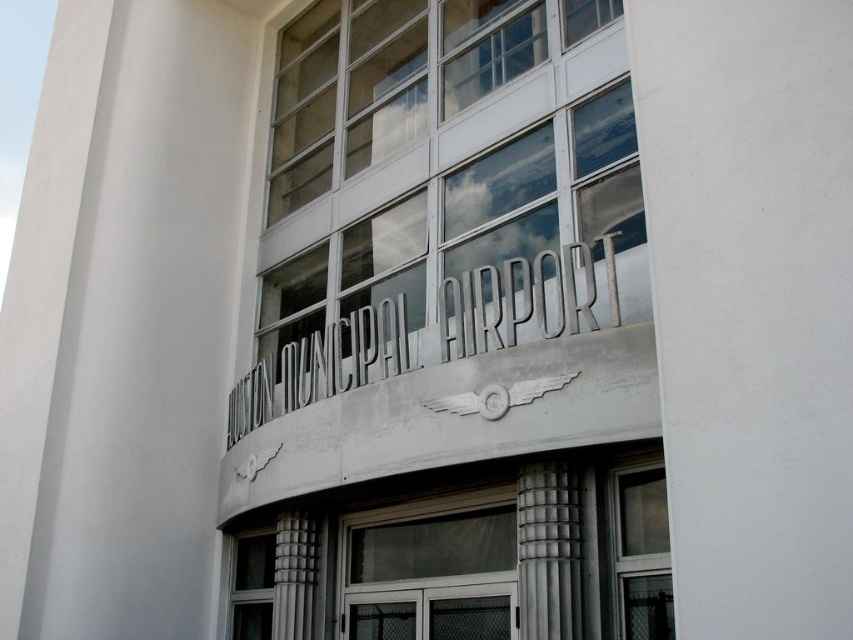
You are a maintenance worker inspecting the Houston Municipal Airport terminal. You need to access the clear glass windows at center and the gray concrete column at right for inspection. Based on their positions, which object is located to the left of the other?

The clear glass windows at center is positioned on the left side of gray concrete column at right, so the clear glass windows at center is to the left of the gray concrete column at right.

You are a delivery person trying to enter the Houston Municipal Airport terminal. You see the clear glass windows at center and the clear glass door at center. Which one should you use to enter the building?

You should use the clear glass door at center to enter the building since doors are typically designed for entry and exit, whereas windows are stationary and not meant for passage.